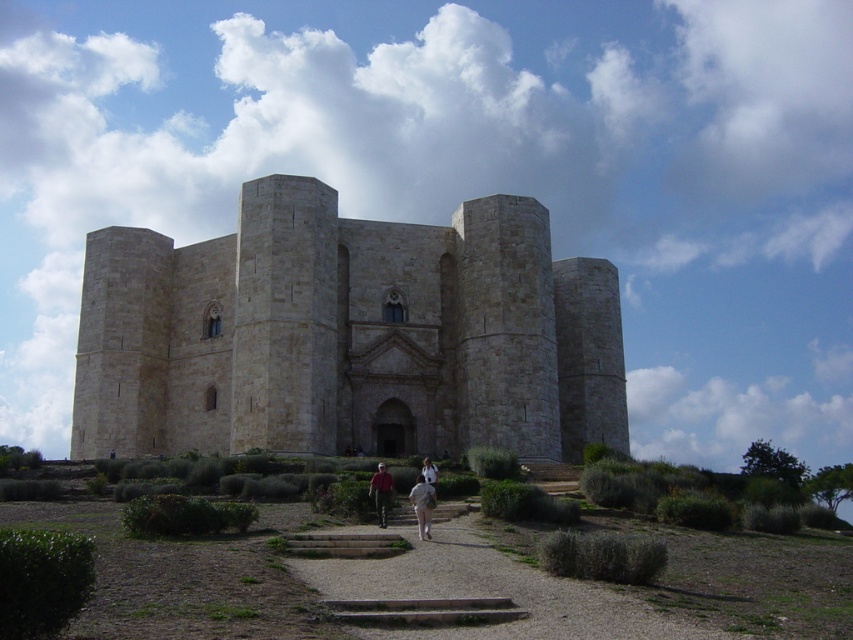
You are standing in front of the historic stone building and notice two items at the center of the image. What is the position of the light beige fabric pants at center relative to the red shirt at center?

The light beige fabric pants at center are positioned under the red shirt at center.

You are standing at the entrance of the historic stone building and want to walk to the red shirt at center without stepping on the gravel pathway at center. Is this possible?

The gravel pathway at center might be wider than red shirt at center, so there is a possibility that you can walk to the red shirt at center without stepping on the gravel pathway at center if you stay on the sides.